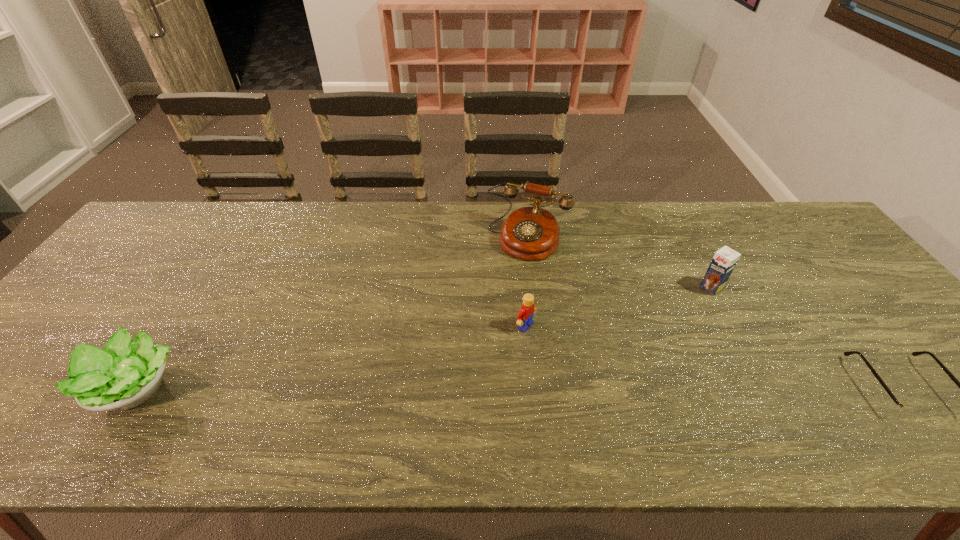
Identify the location of vacant space located on the face of the third farthest object. The image size is (960, 540). (565, 350).

The height and width of the screenshot is (540, 960). What are the coordinates of `free space located 0.280m on the face of the third farthest object` in the screenshot? It's located at (638, 395).

At what (x,y) coordinates should I click in order to perform the action: click on vacant position located 0.130m on the face of the third farthest object. Please return your answer as a coordinate pair (x, y). The image size is (960, 540). Looking at the image, I should click on (580, 359).

Where is `free space located on the front label of the fourth shortest object`? Image resolution: width=960 pixels, height=540 pixels. free space located on the front label of the fourth shortest object is located at coordinates (612, 359).

At what (x,y) coordinates should I click in order to perform the action: click on vacant space located 0.170m on the front label of the fourth shortest object. Please return your answer as a coordinate pair (x, y). Looking at the image, I should click on point(665,321).

What are the coordinates of `vacant region located 0.380m on the front label of the fourth shortest object` in the screenshot? It's located at (610, 361).

Image resolution: width=960 pixels, height=540 pixels. I want to click on object at the far edge, so click(531, 233).

The image size is (960, 540). I want to click on object that is at the near edge, so click(126, 373).

This screenshot has width=960, height=540. I want to click on free region at the far edge of the desktop, so click(x=316, y=232).

Find the location of a particular element. This screenshot has width=960, height=540. vacant space at the near edge of the desktop is located at coordinates 483,377.